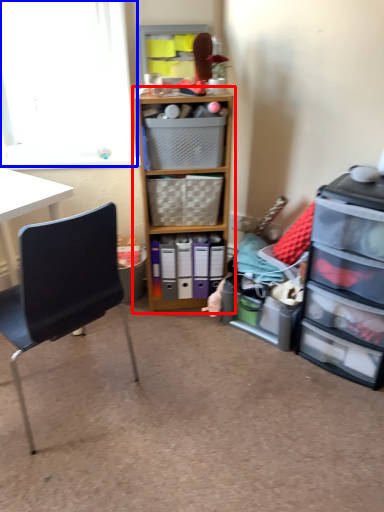
Question: Which point is further to the camera, cabinetry (highlighted by a red box) or window screen (highlighted by a blue box)?

Choices:
 (A) cabinetry
 (B) window screen

Answer: (B)